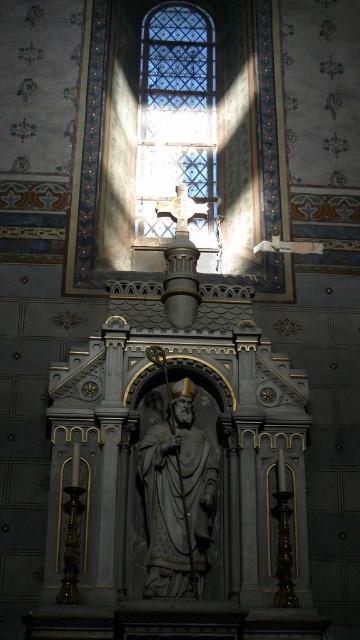
Is clear glass cross at upper center wider than white marble statue at center?

Yes, clear glass cross at upper center is wider than white marble statue at center.

Does clear glass cross at upper center lie behind white marble statue at center?

That is True.

You are a GUI agent. You are given a task and a screenshot of the screen. Output one action in this format:
    pyautogui.click(x=<x>, y=<y>)
    Task: Click on the clear glass cross at upper center
    This screenshot has height=640, width=360.
    Given the screenshot: What is the action you would take?
    pyautogui.click(x=176, y=118)